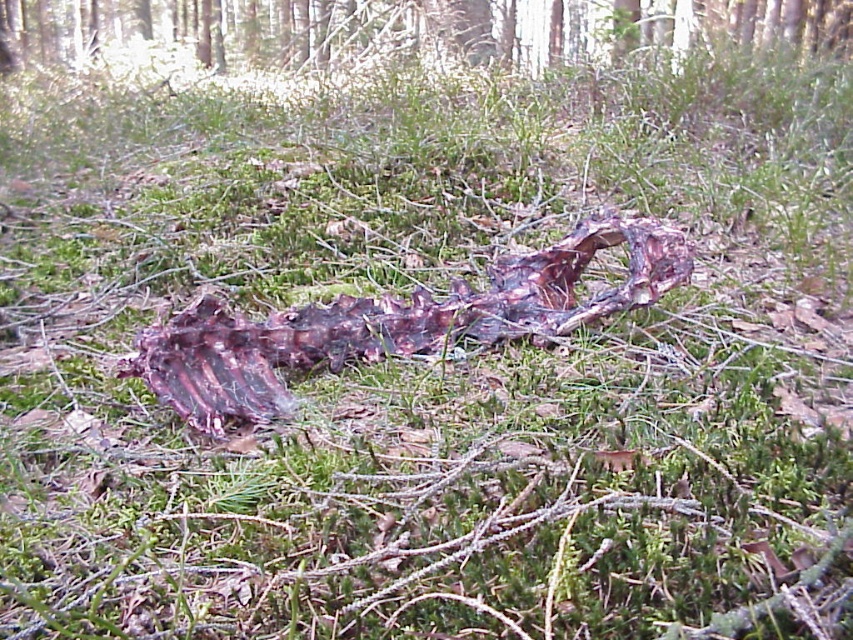
Who is taller, smooth bark tree at upper center or rusty metallic ribcage at center?

smooth bark tree at upper center

Is smooth bark tree at upper center to the left of rusty metallic ribcage at center from the viewer's perspective?

Indeed, smooth bark tree at upper center is positioned on the left side of rusty metallic ribcage at center.

Is point (268, 22) positioned after point (224, 353)?

That is True.

Find the location of a particular element. smooth bark tree at upper center is located at coordinates [415, 26].